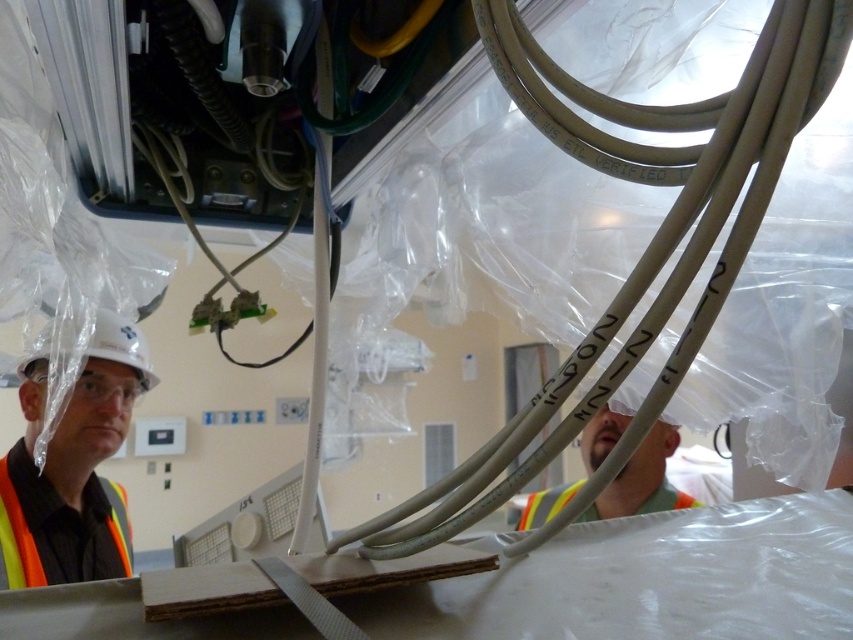
Question: Which object is farther from the camera taking this photo?

Choices:
 (A) beige rubber cable at center
 (B) matte white hard hat at left
 (C) orange reflective safety vest at lower left
 (D) reflective silver helmet at center

Answer: (D)

Question: Can you confirm if matte white hard hat at left is positioned to the left of orange reflective safety vest at lower left?

Choices:
 (A) yes
 (B) no

Answer: (B)

Question: Is beige rubber cable at center to the right of orange reflective safety vest at lower left from the viewer's perspective?

Choices:
 (A) yes
 (B) no

Answer: (A)

Question: Which point is closer to the camera?

Choices:
 (A) (677, 170)
 (B) (22, 554)
 (C) (606, 449)
 (D) (123, 380)

Answer: (A)

Question: Which is farther from the orange reflective safety vest at lower left?

Choices:
 (A) matte white hard hat at left
 (B) beige rubber cable at center

Answer: (B)

Question: Is matte white hard hat at left positioned behind orange reflective safety vest at lower left?

Choices:
 (A) yes
 (B) no

Answer: (A)